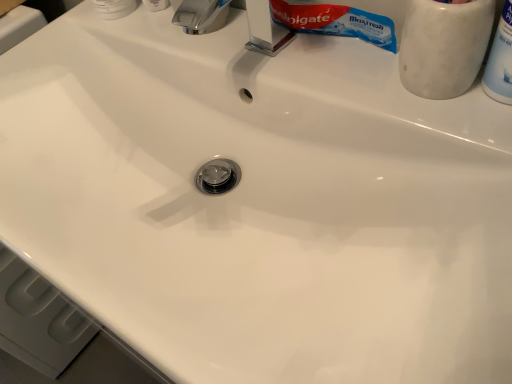
Question: In the image, is chrome metallic faucet at upper center on the left side or the right side of white plastic bottle at upper right, marked as the third toiletry in a left-to-right arrangement?

Choices:
 (A) left
 (B) right

Answer: (A)

Question: Is point (201, 9) positioned closer to the camera than point (507, 14)?

Choices:
 (A) farther
 (B) closer

Answer: (A)

Question: Which object is the closest to the white plastic bottle at upper right, which is counted as the first toiletry, starting from the right?

Choices:
 (A) white plastic toothpaste tube at upper left, arranged as the 3th toiletry when viewed from the right
 (B) white marble toothbrush holder at upper right, acting as the second toiletry starting from the left
 (C) chrome metallic faucet at upper center

Answer: (B)

Question: Which of these objects is positioned closest to the white plastic toothpaste tube at upper left, which ranks as the first toiletry in left-to-right order?

Choices:
 (A) white marble toothbrush holder at upper right, acting as the second toiletry starting from the left
 (B) chrome metallic faucet at upper center
 (C) white plastic bottle at upper right, which is counted as the first toiletry, starting from the right

Answer: (B)